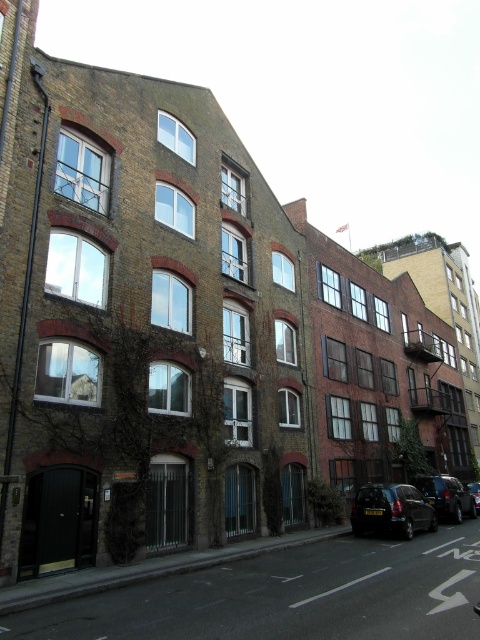
Does point (66, 365) lie in front of point (477, 500)?

That is True.

Can you confirm if green ivy at center is positioned to the right of shiny black car at center?

In fact, green ivy at center is to the left of shiny black car at center.

This screenshot has width=480, height=640. What do you see at coordinates (112, 438) in the screenshot? I see `green ivy at center` at bounding box center [112, 438].

You are a GUI agent. You are given a task and a screenshot of the screen. Output one action in this format:
    pyautogui.click(x=<x>, y=<y>)
    Task: Click on the green ivy at center
    Image resolution: width=480 pixels, height=640 pixels.
    Given the screenshot: What is the action you would take?
    pyautogui.click(x=112, y=438)

Is black matte car at lower right thinner than shiny black car at lower right?

No, black matte car at lower right is not thinner than shiny black car at lower right.

Find the location of a particular element. black matte car at lower right is located at coordinates (392, 509).

Where is `black matte car at lower right`? black matte car at lower right is located at coordinates (392, 509).

Which is in front, point (396, 493) or point (477, 481)?

Point (396, 493) is in front.

Does black matte car at lower right have a lesser height compared to shiny black car at center?

Yes.

Between point (385, 484) and point (472, 496), which one is positioned in front?

Positioned in front is point (385, 484).

The image size is (480, 640). I want to click on black matte car at lower right, so click(392, 509).